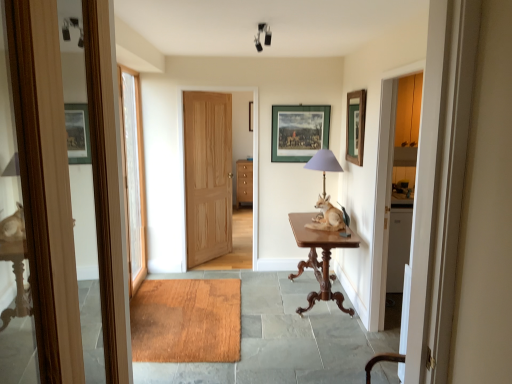
Image resolution: width=512 pixels, height=384 pixels. Identify the location of vacant point to the left of mahogany wood table at center. (265, 296).